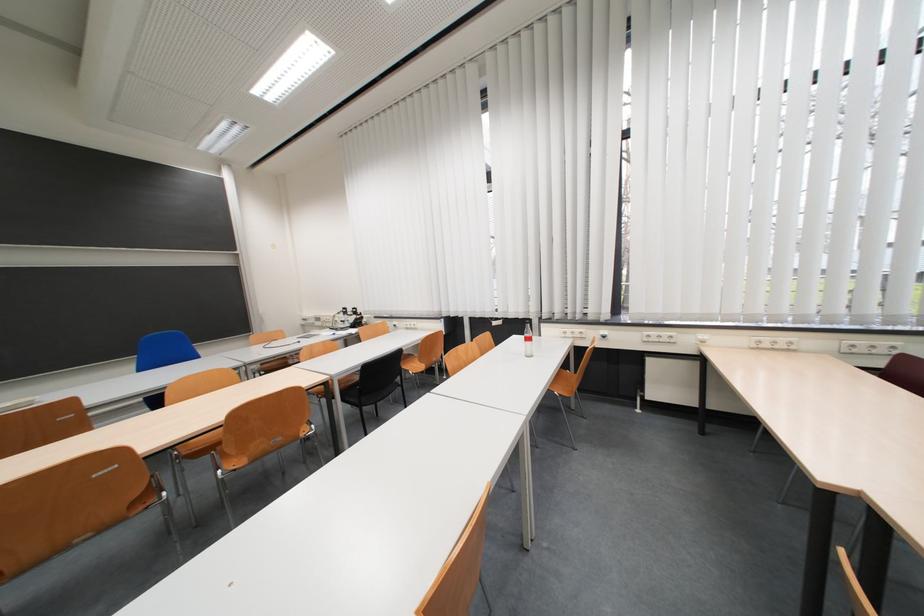
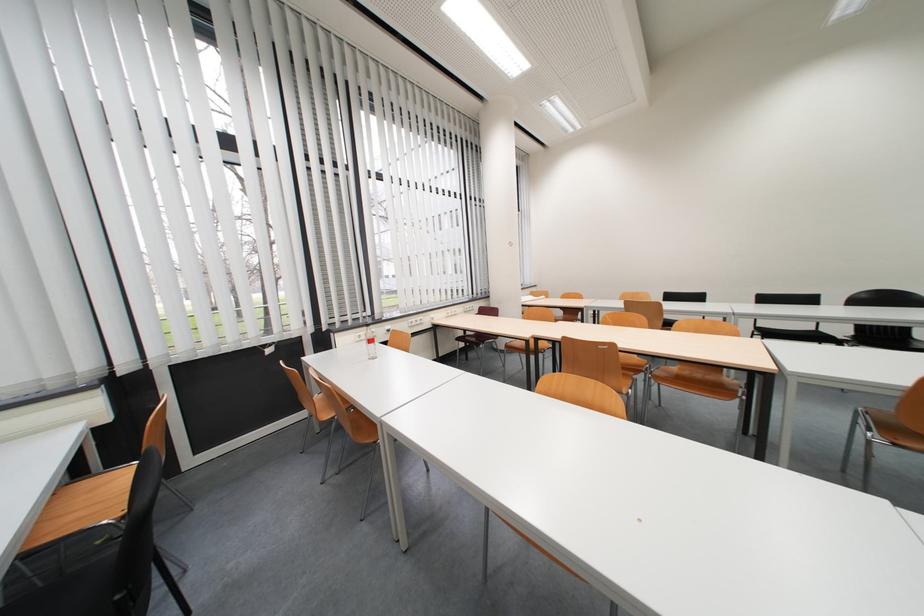
Question: I am providing you with two images of the same scene from different viewpoints. Which of the following objects are not visible in image2?

Choices:
 (A) glass carafe bottle
 (B) brown chair sitting surface
 (C) wooden chair sitting surface
 (D) black chair sitting surface

Answer: (C)